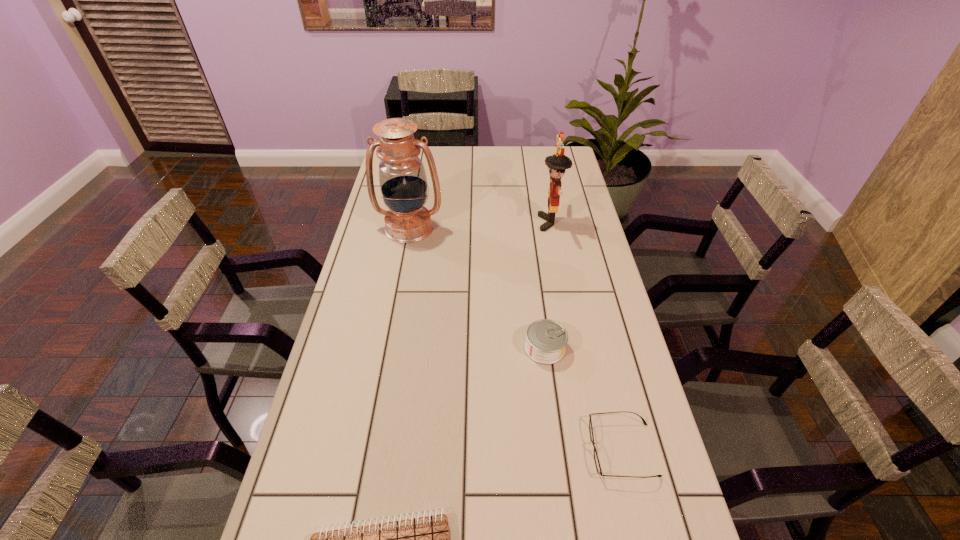
Locate an element on the screen. The height and width of the screenshot is (540, 960). vacant space located 0.070m on the front of the can is located at coordinates (550, 388).

Locate an element on the screen. This screenshot has width=960, height=540. free space located on the front-facing side of the fourth farthest object is located at coordinates (560, 449).

This screenshot has height=540, width=960. In order to click on vacant area located 0.140m on the front-facing side of the fourth farthest object in this screenshot , I will do `click(528, 449)`.

Locate an element on the screen. The height and width of the screenshot is (540, 960). free region located 0.180m on the front-facing side of the fourth farthest object is located at coordinates (511, 449).

The width and height of the screenshot is (960, 540). What are the coordinates of `object that is at the left edge` in the screenshot? It's located at (403, 182).

The image size is (960, 540). Find the location of `nutcracker at the right edge`. nutcracker at the right edge is located at coordinates (557, 164).

You are a GUI agent. You are given a task and a screenshot of the screen. Output one action in this format:
    pyautogui.click(x=<x>, y=<y>)
    Task: Click on the spectacles located in the right edge section of the desktop
    The width and height of the screenshot is (960, 540).
    Given the screenshot: What is the action you would take?
    pyautogui.click(x=596, y=459)

At what (x,y) coordinates should I click in order to perform the action: click on vacant region at the far edge of the desktop. Please return your answer as a coordinate pair (x, y). The image size is (960, 540). Looking at the image, I should click on (515, 146).

Locate an element on the screen. The width and height of the screenshot is (960, 540). vacant space at the left edge is located at coordinates (350, 284).

In the image, there is a desktop. Identify the location of vacant space at the right edge. (635, 532).